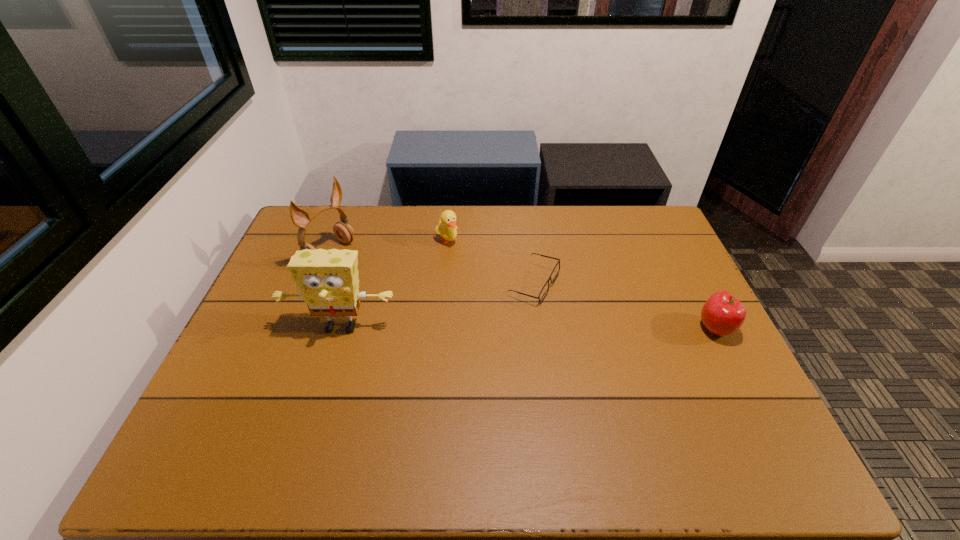
This screenshot has width=960, height=540. I want to click on unoccupied position between the earphone and the shortest object, so click(x=432, y=268).

Where is `vacant space in between the shortest object and the third object from left to right`? vacant space in between the shortest object and the third object from left to right is located at coordinates (491, 262).

Identify the location of free space that is in between the second object from right to left and the rightmost object. (624, 306).

You are a GUI agent. You are given a task and a screenshot of the screen. Output one action in this format:
    pyautogui.click(x=<x>, y=<y>)
    Task: Click on the free space that is in between the earphone and the third object from left to right
    
    Given the screenshot: What is the action you would take?
    click(389, 247)

Identify the location of empty space between the sponge and the apple. The width and height of the screenshot is (960, 540). (528, 328).

This screenshot has width=960, height=540. I want to click on vacant area that lies between the sponge and the third object from left to right, so click(x=394, y=284).

Find the location of a particular element. This screenshot has height=540, width=960. vacant area that lies between the earphone and the fourth object from left to right is located at coordinates (432, 268).

The height and width of the screenshot is (540, 960). I want to click on free space between the apple and the earphone, so click(522, 291).

Image resolution: width=960 pixels, height=540 pixels. Find the location of `free point between the earphone and the shortest object`. free point between the earphone and the shortest object is located at coordinates (432, 268).

Choose which object is the second nearest neighbor to the second object from right to left. Please provide its 2D coordinates. Your answer should be formatted as a tuple, i.e. [(x, y)], where the tuple contains the x and y coordinates of a point satisfying the conditions above.

[(328, 282)]